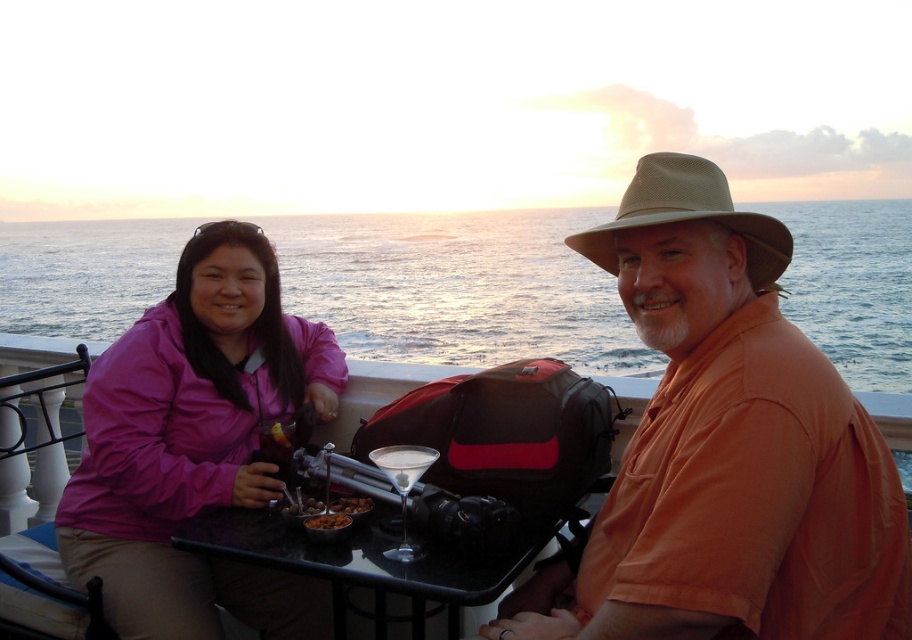
Question: Which object appears closest to the camera in this image?

Choices:
 (A) crumbly brown bread at table center
 (B) pink fabric jacket at left

Answer: (A)

Question: Can you confirm if pink fabric jacket at left is bigger than shiny metallic bowl at table center?

Choices:
 (A) yes
 (B) no

Answer: (A)

Question: From the image, what is the correct spatial relationship of blue water at center in relation to crumbly brown bread at table center?

Choices:
 (A) right
 (B) left

Answer: (B)

Question: Can you confirm if orange cotton shirt at center is wider than shiny metallic bowl at table center?

Choices:
 (A) no
 (B) yes

Answer: (B)

Question: Which point is farther from the camera taking this photo?

Choices:
 (A) (313, 518)
 (B) (745, 403)
 (C) (149, 412)

Answer: (C)

Question: Which object is the closest to the crumbly brown bread at table center?

Choices:
 (A) orange cotton shirt at center
 (B) shiny metallic bowl at table center
 (C) pink fabric jacket at left
 (D) beige mesh cowboy hat at upper right

Answer: (B)